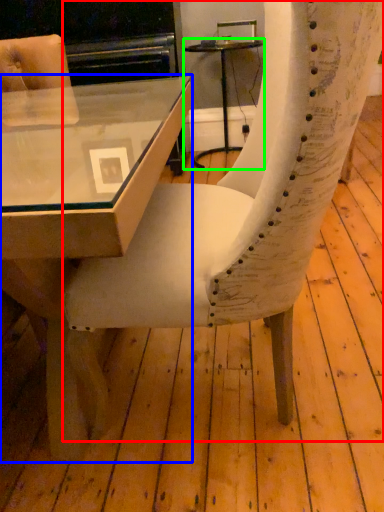
Question: Which object is the farthest from chair (highlighted by a red box)? Choose among these: table (highlighted by a blue box) or table (highlighted by a green box).

Choices:
 (A) table
 (B) table

Answer: (B)